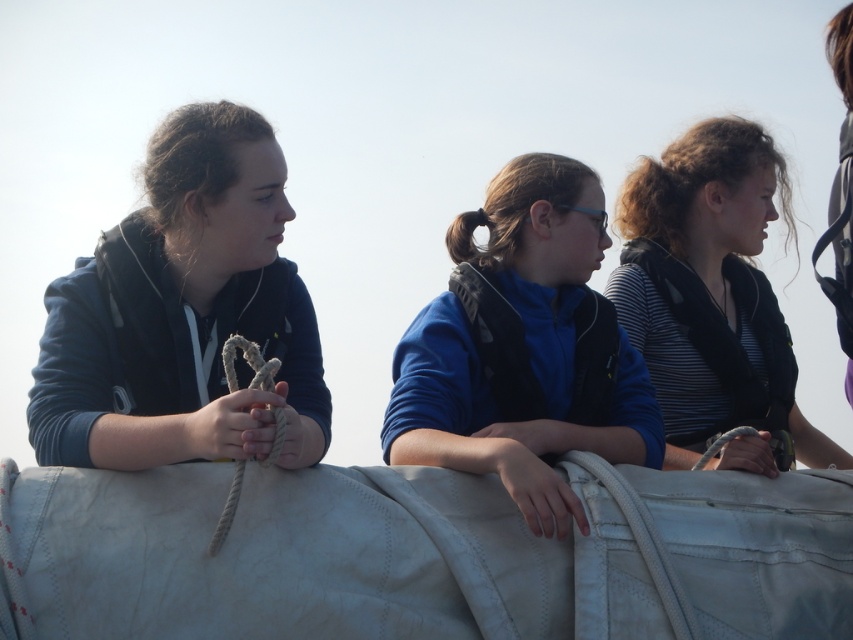
You are a photographer trying to capture a group photo of the three people on the boat deck. You want to ensure that both the blue fleece jacket at center and the striped fabric shirt at center are clearly visible in the frame. Given their sizes, which clothing item should you focus on to ensure it fits within the camera frame first?

The blue fleece jacket at center has a smaller width than the striped fabric shirt at center. Therefore, you should focus on ensuring the striped fabric shirt at center fits first since it is wider and requires more space in the frame.

You are a photographer trying to capture a closeup of the person on the right. You are currently focused on the point at point (x=170, y=369). If you shift your focus to point (x=567, y=212), will the subject become more out of focus or more in focus?

Shifting focus to point (x=567, y=212) will make the subject more out of focus because point (x=170, y=369) is closer to the camera than point (x=567, y=212).

You are a photographer trying to decide which clothing items to bring for a boat trip. You have limited space in your bag. Based on the image, which clothing item between the matte blue hoodie at left and the striped fabric shirt at center would you prioritize packing if you want to carry the larger one?

The striped fabric shirt at center is larger than the matte blue hoodie at left, so you should prioritize packing the striped fabric shirt at center.